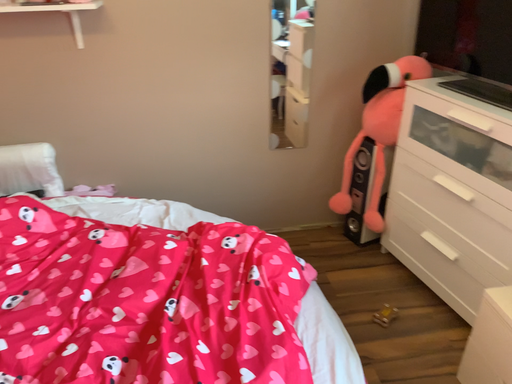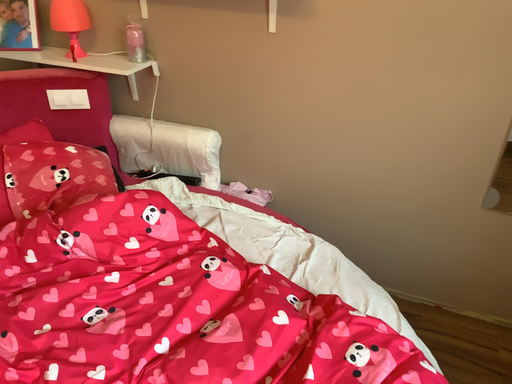
Question: Which way did the camera rotate in the video?

Choices:
 (A) rotated right
 (B) rotated left

Answer: (B)